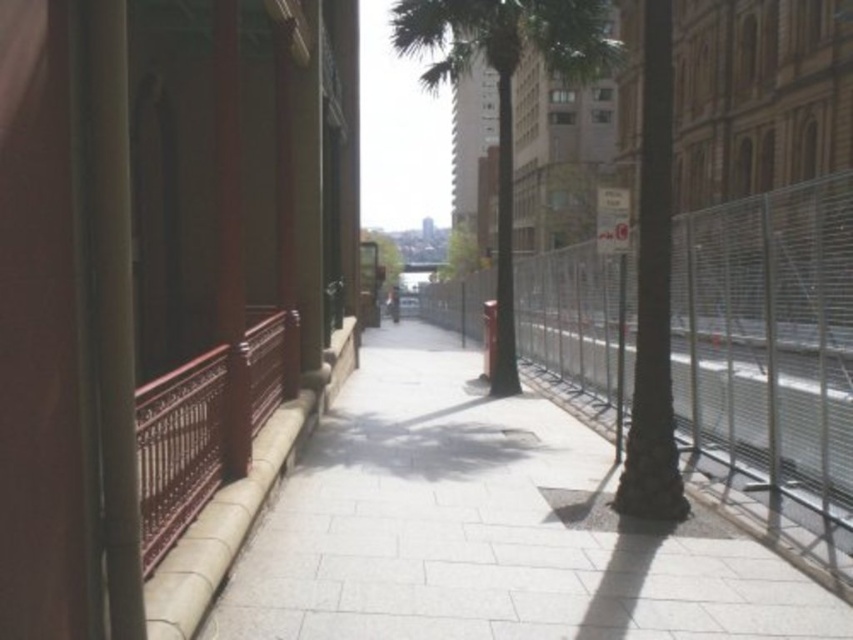
You are a delivery person carrying a large box that is 2 meters wide. You need to navigate through the narrow urban pathway shown in the image. Can you pass between the white stone pavement at center and the green leafy palm tree at center without tilting the box sideways?

The white stone pavement at center is thinner than the green leafy palm tree at center, so the space between them is narrower than the width of the box. Therefore, you cannot pass through without tilting the box sideways.

You are a delivery drone flying over an urban pathway. You need to navigate between two points marked as point (834, 240) and point (482, 36). According to the scene, which point is closer to the delivery location if the delivery location is directly ahead of your current position?

Point (834, 240) is in front of point (482, 36), so the delivery location is closer to point (834, 240) if it is directly ahead.